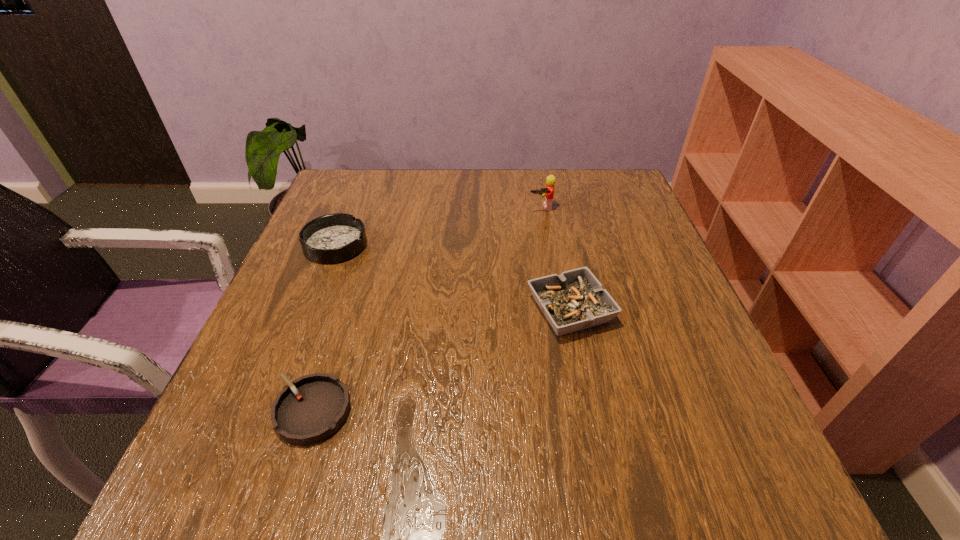
Find the location of a particular element. The height and width of the screenshot is (540, 960). blank region between the Lego and the farthest ashtray is located at coordinates (439, 226).

At what (x,y) coordinates should I click in order to perform the action: click on free area in between the nearest object and the second nearest object. Please return your answer as a coordinate pair (x, y). The height and width of the screenshot is (540, 960). Looking at the image, I should click on (442, 360).

Where is `free space between the Lego and the second farthest object`? The width and height of the screenshot is (960, 540). free space between the Lego and the second farthest object is located at coordinates (439, 226).

Locate an element on the screen. Image resolution: width=960 pixels, height=540 pixels. unoccupied area between the second farthest ashtray and the farthest ashtray is located at coordinates (453, 278).

Locate an element on the screen. vacant point located between the nearest object and the third nearest object is located at coordinates (324, 328).

Where is `vacant space in between the second farthest ashtray and the Lego`? This screenshot has height=540, width=960. vacant space in between the second farthest ashtray and the Lego is located at coordinates (556, 259).

Find the location of a particular element. vacant area between the second farthest object and the tallest object is located at coordinates tap(439, 226).

Identify the location of free space between the rightmost ashtray and the second farthest object. This screenshot has width=960, height=540. (453, 278).

At what (x,y) coordinates should I click in order to perform the action: click on free space between the rightmost ashtray and the shortest object. Please return your answer as a coordinate pair (x, y). Looking at the image, I should click on (442, 360).

This screenshot has height=540, width=960. In order to click on free space between the shortest object and the third farthest object in this screenshot , I will do `click(442, 360)`.